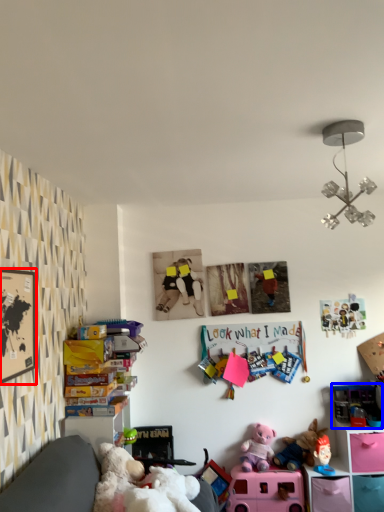
Question: Among these objects, which one is nearest to the camera, picture frame (highlighted by a red box) or toy (highlighted by a blue box)?

Choices:
 (A) picture frame
 (B) toy

Answer: (A)